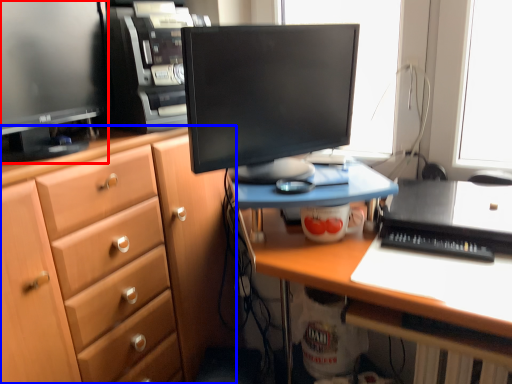
Question: Which object is further to the camera taking this photo, computer monitor (highlighted by a red box) or cabinetry (highlighted by a blue box)?

Choices:
 (A) computer monitor
 (B) cabinetry

Answer: (A)